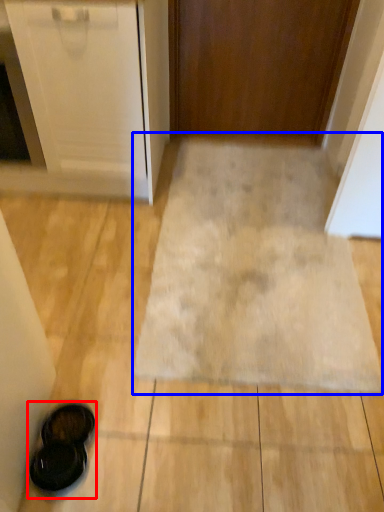
Question: Which of the following is the farthest to the observer, footwear (highlighted by a red box) or bath mat (highlighted by a blue box)?

Choices:
 (A) footwear
 (B) bath mat

Answer: (B)